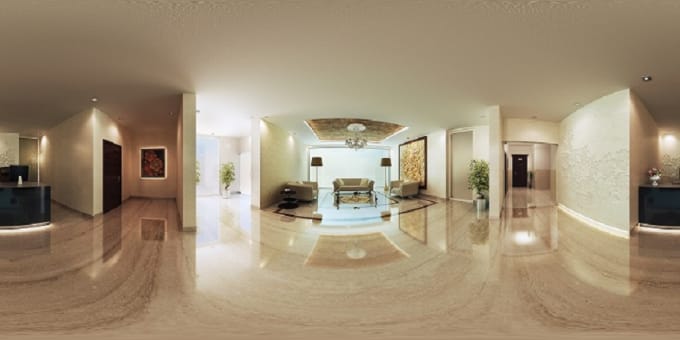
Find the location of a particular element. lamp is located at coordinates (318, 163), (387, 161).